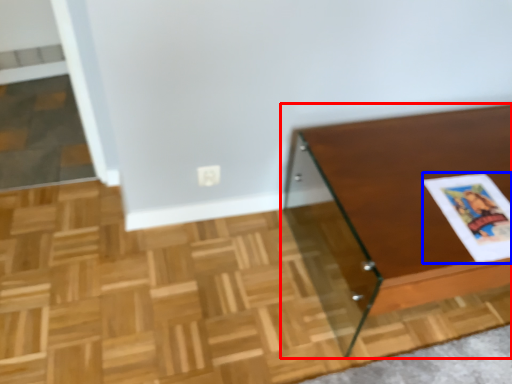
Question: Among these objects, which one is nearest to the camera, table (highlighted by a red box) or magazine (highlighted by a blue box)?

Choices:
 (A) table
 (B) magazine

Answer: (A)